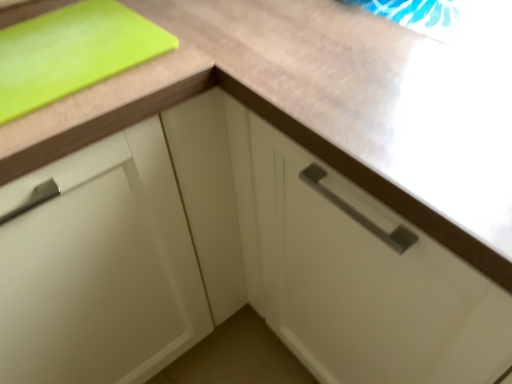
Question: In the image, is matte white cabinet at left on the left side or the right side of green matte cutting board at upper left?

Choices:
 (A) right
 (B) left

Answer: (B)

Question: Is matte white cabinet at left in front of or behind green matte cutting board at upper left in the image?

Choices:
 (A) front
 (B) behind

Answer: (A)

Question: Is matte white cabinet at left taller or shorter than green matte cutting board at upper left?

Choices:
 (A) short
 (B) tall

Answer: (B)

Question: Is point 61,18 positioned closer to the camera than point 130,173?

Choices:
 (A) farther
 (B) closer

Answer: (A)

Question: Which is correct: green matte cutting board at upper left is inside matte white cabinet at left, or outside of it?

Choices:
 (A) outside
 (B) inside

Answer: (B)

Question: From the image's perspective, relative to matte white cabinet at left, is green matte cutting board at upper left above or below?

Choices:
 (A) above
 (B) below

Answer: (A)

Question: Is green matte cutting board at upper left bigger or smaller than matte white cabinet at left?

Choices:
 (A) small
 (B) big

Answer: (A)